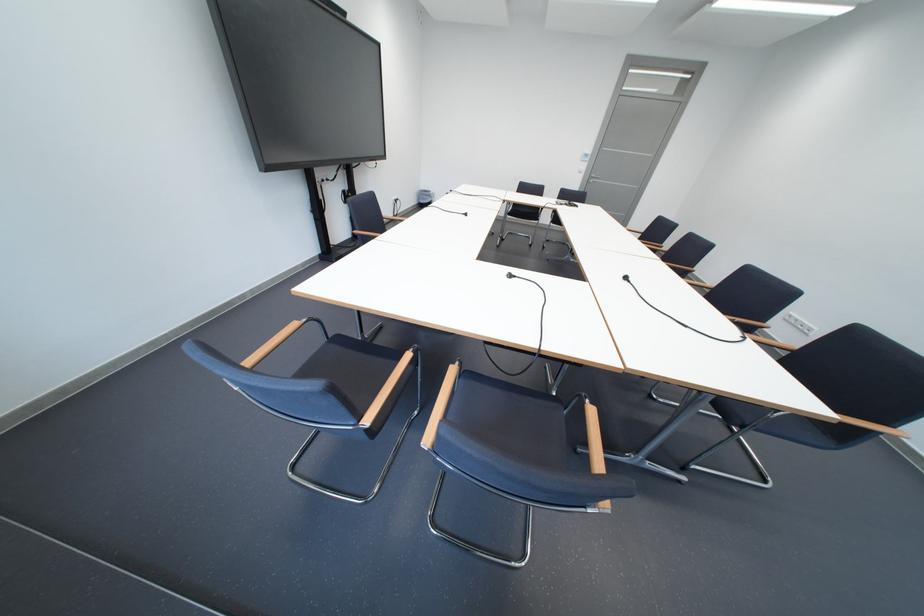
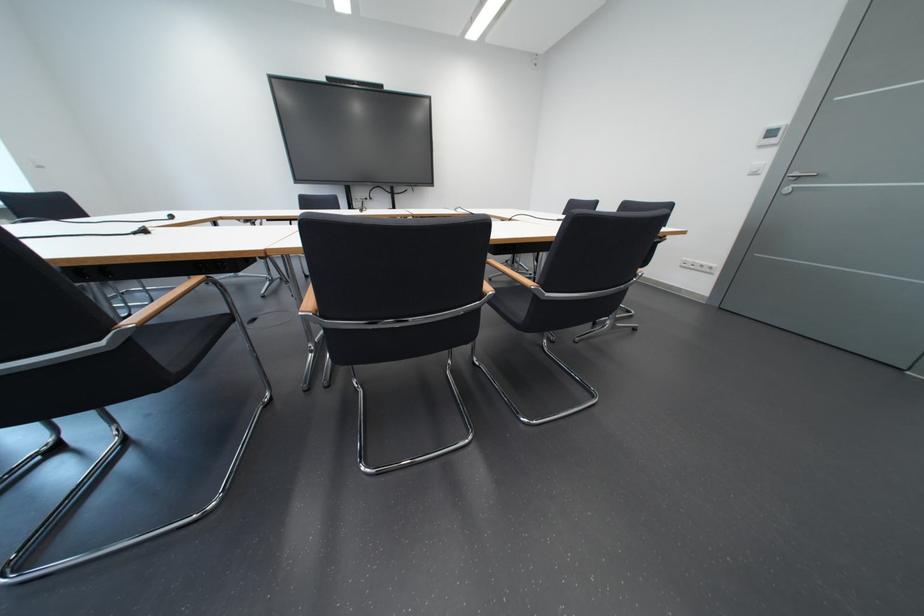
Question: I am providing you with two images of the same scene from different viewpoints. After the viewpoint changes to image2, which objects are now occluded?

Choices:
 (A) white light switch
 (B) black soap dispenser
 (C) wooden chair armrest
 (D) black chair sitting surface

Answer: (C)